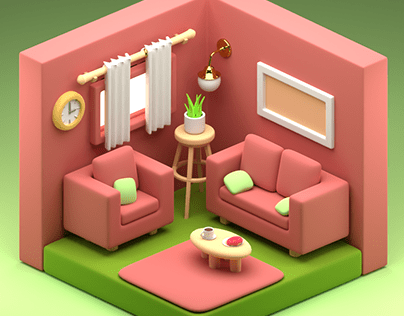
This screenshot has width=404, height=316. What are the coordinates of `green throw pillows` in the screenshot? It's located at (239, 183), (281, 206), (123, 188).